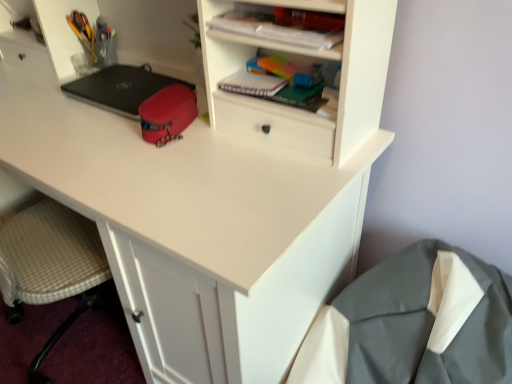
Locate an element on the screen. The height and width of the screenshot is (384, 512). vacant space situated above matte red pouch at center, positioned as the 2th stationery in back-to-front order (from a real-world perspective) is located at coordinates (163, 94).